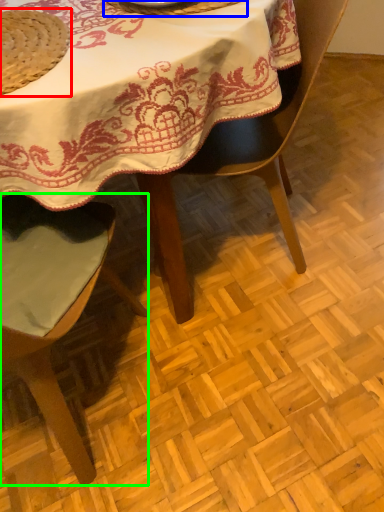
Question: Which is farther away from straw hat (highlighted by a red box)? tableware (highlighted by a blue box) or chair (highlighted by a green box)?

Choices:
 (A) tableware
 (B) chair

Answer: (B)